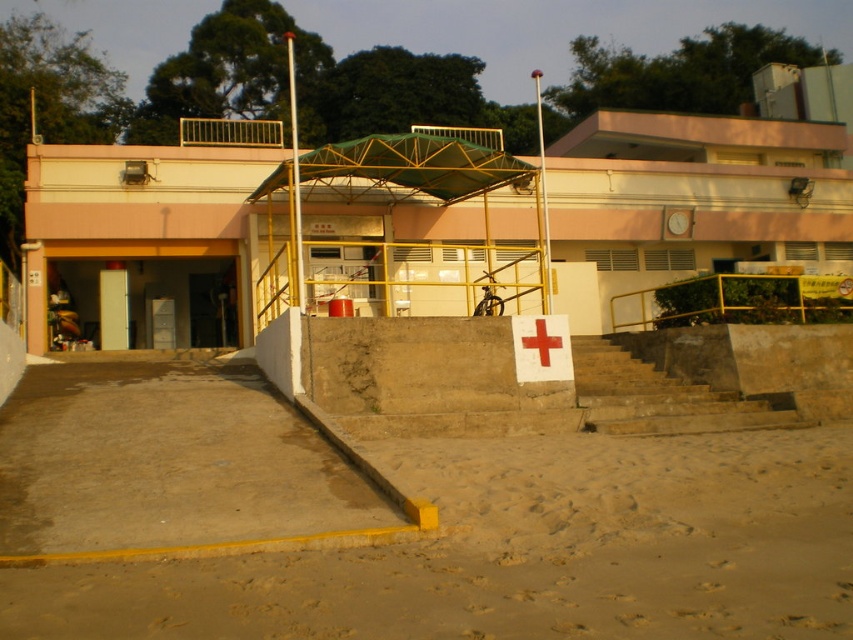
Question: Does brown stone stairs at center have a smaller size compared to white paper cross at center?

Choices:
 (A) yes
 (B) no

Answer: (B)

Question: Considering the real-world distances, which object is farthest from the white paper cross at center?

Choices:
 (A) brown stone stairs at center
 (B) sandy at lower center

Answer: (B)

Question: Is brown stone stairs at center thinner than white paper cross at center?

Choices:
 (A) no
 (B) yes

Answer: (A)

Question: Estimate the real-world distances between objects in this image. Which object is farther from the sandy at lower center?

Choices:
 (A) brown stone stairs at center
 (B) white paper cross at center

Answer: (A)

Question: Which of the following is the farthest from the observer?

Choices:
 (A) white paper cross at center
 (B) sandy at lower center
 (C) brown stone stairs at center

Answer: (A)

Question: Can you confirm if brown stone stairs at center is positioned above white paper cross at center?

Choices:
 (A) no
 (B) yes

Answer: (A)